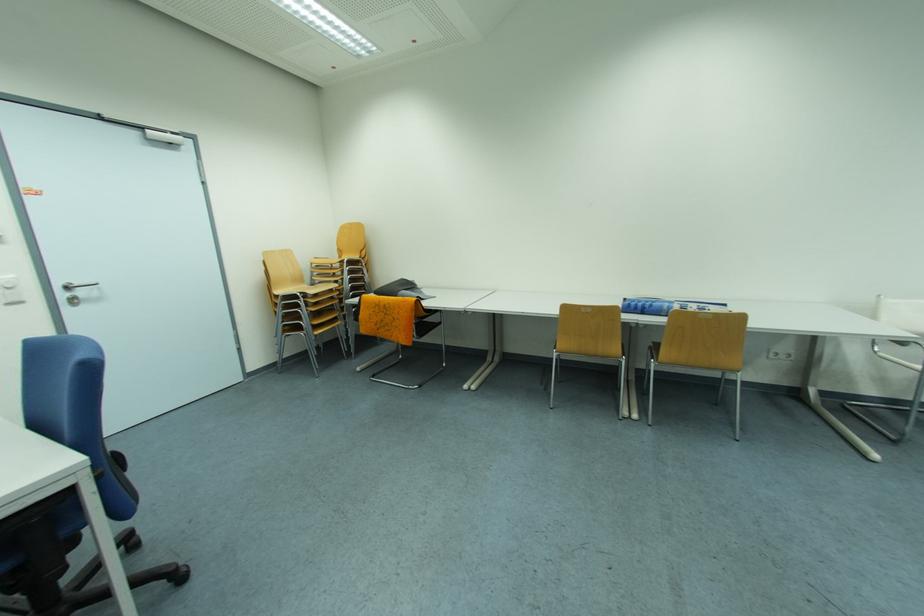
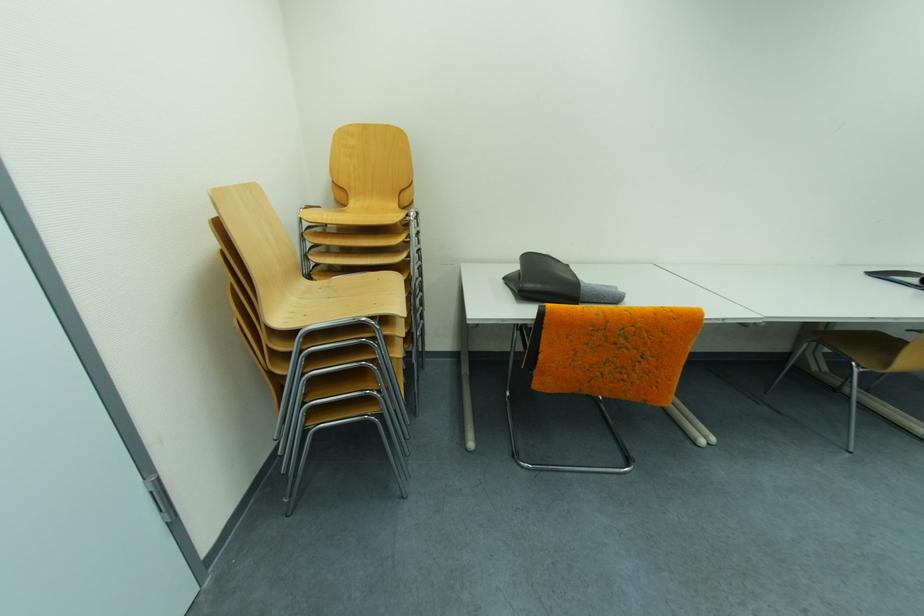
Consider the image. The images are taken continuously from a first-person perspective. In which direction are you moving?

The cameraman moved toward left, forward.